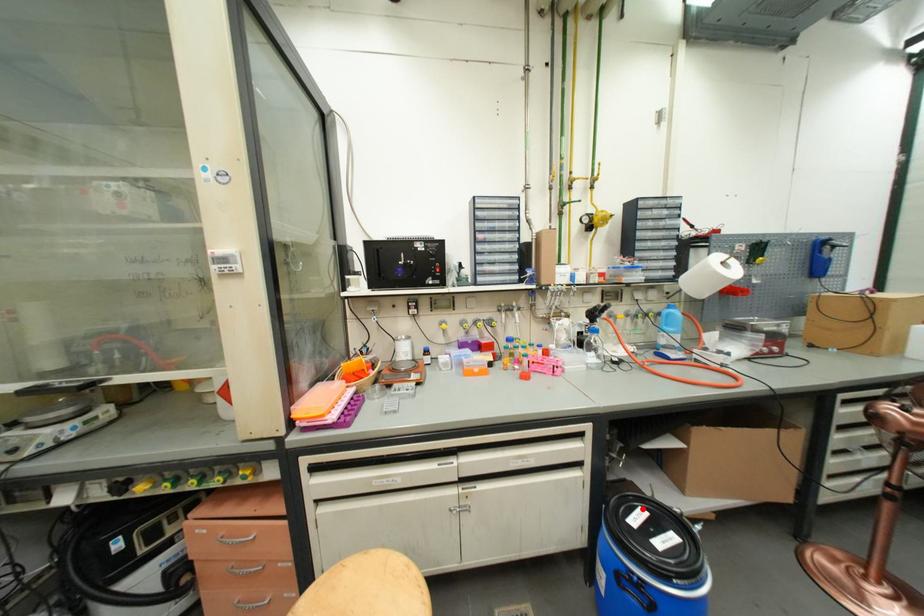
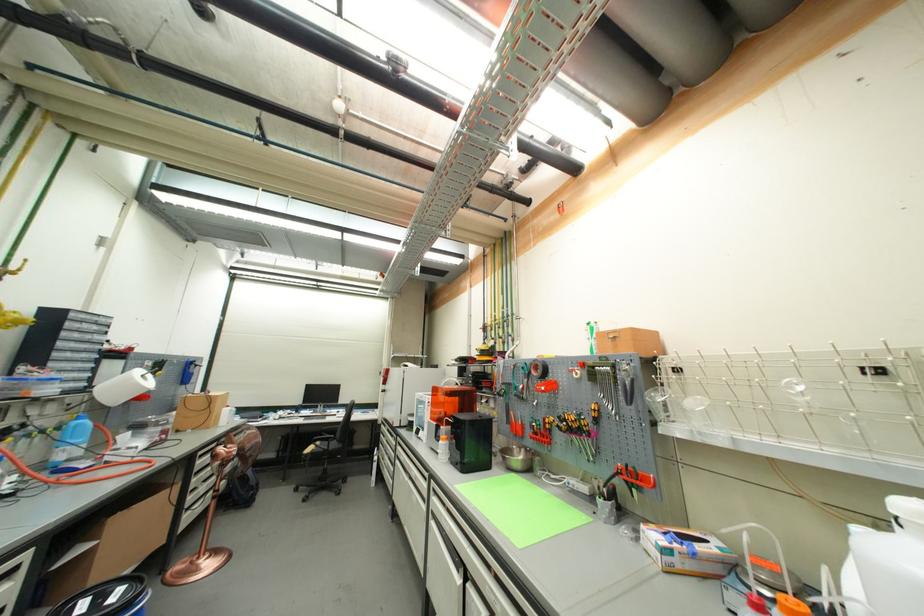
Question: A red point is marked in image1. In image2, is the corresponding 3D point closer to the camera or farther? Reply with the corresponding letter.

Choices:
 (A) The corresponding 3D point is closer.
 (B) The corresponding 3D point is farther.

Answer: (B)